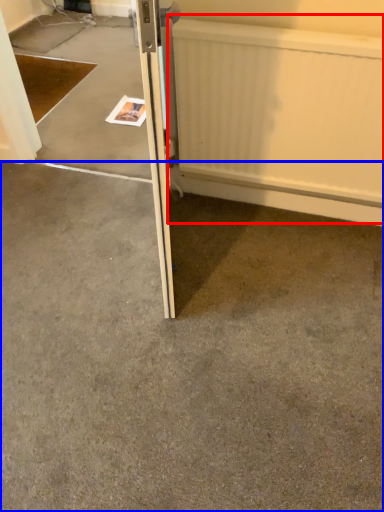
Question: Which point is further to the camera, radiator (highlighted by a red box) or concrete (highlighted by a blue box)?

Choices:
 (A) radiator
 (B) concrete

Answer: (A)